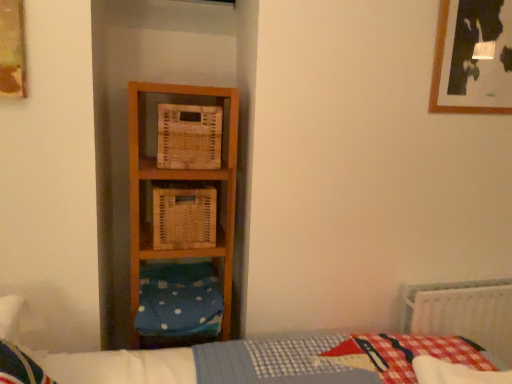
Question: Considering the relative sizes of wooden picture frame at upper left, marked as the 1th picture frame in a left-to-right arrangement, and blue polka dot fabric at lower left in the image provided, is wooden picture frame at upper left, marked as the 1th picture frame in a left-to-right arrangement, taller than blue polka dot fabric at lower left?

Choices:
 (A) no
 (B) yes

Answer: (B)

Question: Considering the relative sizes of wooden picture frame at upper left, the first picture frame from the front, and blue polka dot fabric at lower left in the image provided, is wooden picture frame at upper left, the first picture frame from the front, smaller than blue polka dot fabric at lower left?

Choices:
 (A) no
 (B) yes

Answer: (B)

Question: Does wooden picture frame at upper left, marked as the 1th picture frame in a left-to-right arrangement, have a lesser height compared to blue polka dot fabric at lower left?

Choices:
 (A) yes
 (B) no

Answer: (B)

Question: Would you say wooden picture frame at upper left, marked as the 1th picture frame in a left-to-right arrangement, contains blue polka dot fabric at lower left?

Choices:
 (A) no
 (B) yes

Answer: (A)

Question: From a real-world perspective, is wooden picture frame at upper left, the second picture frame when ordered from right to left, on top of blue polka dot fabric at lower left?

Choices:
 (A) no
 (B) yes

Answer: (B)

Question: Does point (209, 225) appear closer or farther from the camera than point (4, 79)?

Choices:
 (A) farther
 (B) closer

Answer: (A)

Question: Relative to wooden picture frame at upper left, the first picture frame from the front, is woven wicker crate at center, which is counted as the first crate, starting from the bottom, in front or behind?

Choices:
 (A) front
 (B) behind

Answer: (B)

Question: From the image's perspective, relative to wooden picture frame at upper left, marked as the 1th picture frame in a left-to-right arrangement, is woven wicker crate at center, which is counted as the first crate, starting from the bottom, above or below?

Choices:
 (A) below
 (B) above

Answer: (A)

Question: Is woven wicker crate at center, which is counted as the first crate, starting from the bottom, spatially inside wooden picture frame at upper left, the 2th picture frame in the back-to-front sequence, or outside of it?

Choices:
 (A) inside
 (B) outside

Answer: (B)

Question: Considering the positions of woven wood crate at center, which is counted as the second crate, starting from the bottom, and wooden picture frame at upper right, positioned as the 1th picture frame in right-to-left order, in the image, is woven wood crate at center, which is counted as the second crate, starting from the bottom, wider or thinner than wooden picture frame at upper right, positioned as the 1th picture frame in right-to-left order,?

Choices:
 (A) wide
 (B) thin

Answer: (A)

Question: Does point (167, 115) appear closer or farther from the camera than point (451, 76)?

Choices:
 (A) farther
 (B) closer

Answer: (B)

Question: Is woven wood crate at center, which is counted as the second crate, starting from the bottom, to the left or to the right of wooden picture frame at upper right, positioned as the 1th picture frame in right-to-left order, in the image?

Choices:
 (A) right
 (B) left

Answer: (B)

Question: Considering the positions of woven wood crate at center, which is counted as the second crate, starting from the bottom, and wooden picture frame at upper right, positioned as the 1th picture frame in right-to-left order, in the image, is woven wood crate at center, which is counted as the second crate, starting from the bottom, taller or shorter than wooden picture frame at upper right, positioned as the 1th picture frame in right-to-left order,?

Choices:
 (A) tall
 (B) short

Answer: (B)

Question: From a real-world perspective, relative to woven wood crate at center, acting as the first crate starting from the top, is blue polka dot fabric at lower left vertically above or below?

Choices:
 (A) below
 (B) above

Answer: (A)

Question: Is blue polka dot fabric at lower left inside or outside of woven wood crate at center, acting as the first crate starting from the top?

Choices:
 (A) outside
 (B) inside

Answer: (A)